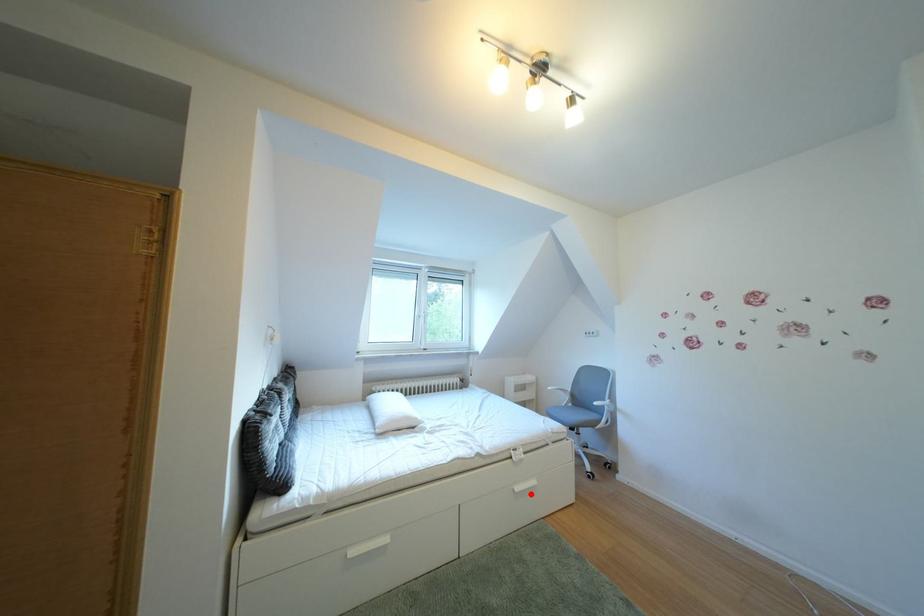
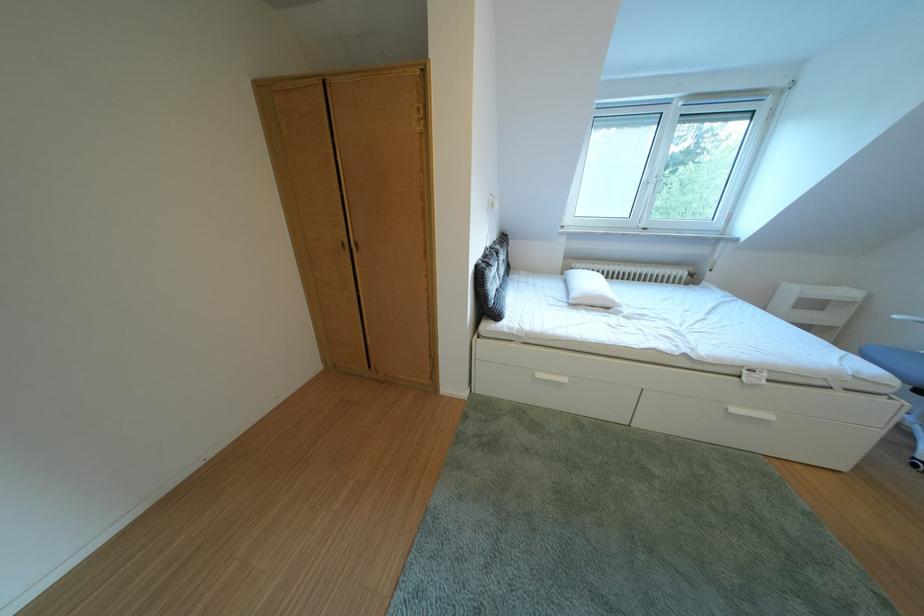
The point at the highlighted location is marked in the first image. Where is the corresponding point in the second image?

(748, 415)